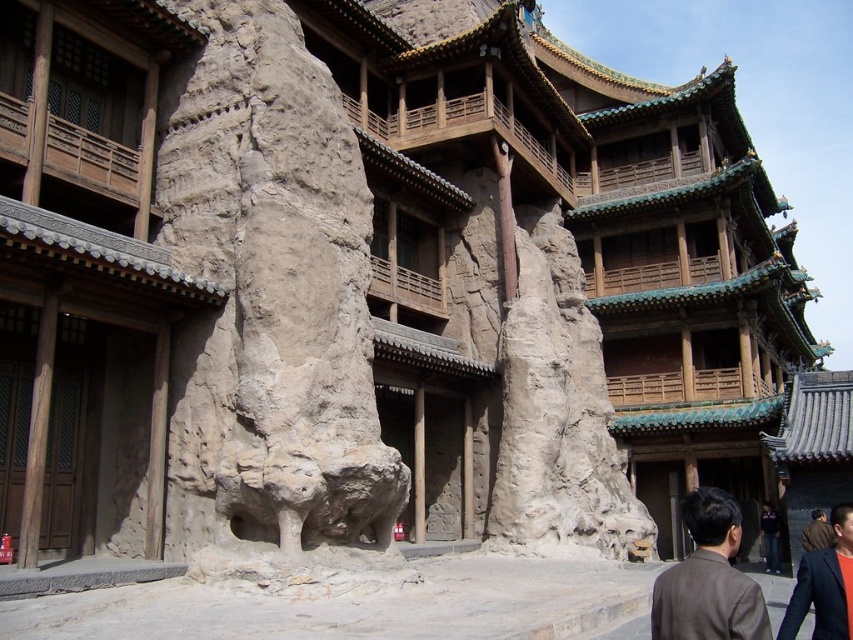
Question: Can you confirm if brown woolen coat at lower right is positioned to the left of dark blue jeans at lower right?

Choices:
 (A) no
 (B) yes

Answer: (B)

Question: Can you confirm if natural stone lion at center is positioned to the right of brown leather jacket at lower right?

Choices:
 (A) yes
 (B) no

Answer: (B)

Question: Considering the real-world distances, which object is farthest from the brown matte jacket at lower right?

Choices:
 (A) brown leather jacket at lower right
 (B) dark blue jeans at lower right
 (C) natural stone lion at center

Answer: (C)

Question: Which point appears farthest from the camera in this image?

Choices:
 (A) (728, 620)
 (B) (822, 516)

Answer: (B)

Question: Considering the relative positions of brown woolen coat at lower right and dark blue jeans at lower right in the image provided, where is brown woolen coat at lower right located with respect to dark blue jeans at lower right?

Choices:
 (A) right
 (B) left

Answer: (B)

Question: Which point appears farthest from the camera in this image?

Choices:
 (A) (791, 634)
 (B) (316, 396)
 (C) (807, 540)

Answer: (C)